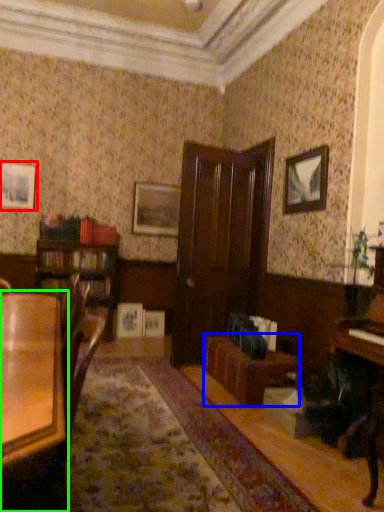
Question: Estimate the real-world distances between objects in this image. Which object is farther from picture frame (highlighted by a red box), couch (highlighted by a blue box) or table (highlighted by a green box)?

Choices:
 (A) couch
 (B) table

Answer: (B)